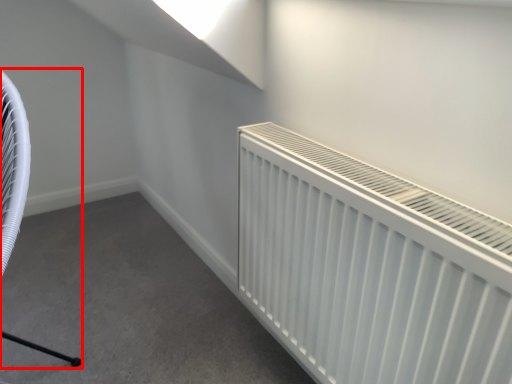
Question: From the image's perspective, where is swivel chair (annotated by the red box) located in relation to radiator in the image?

Choices:
 (A) above
 (B) below

Answer: (A)